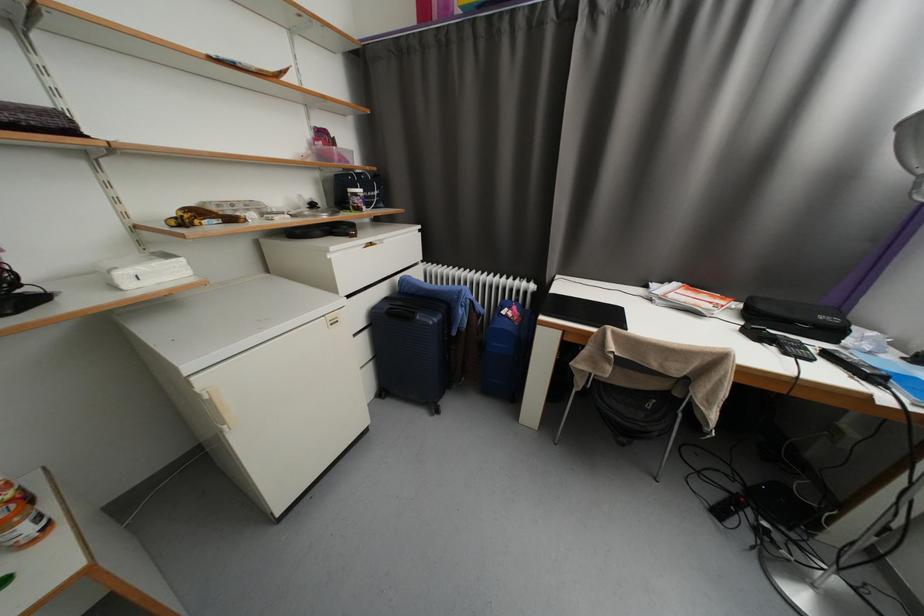
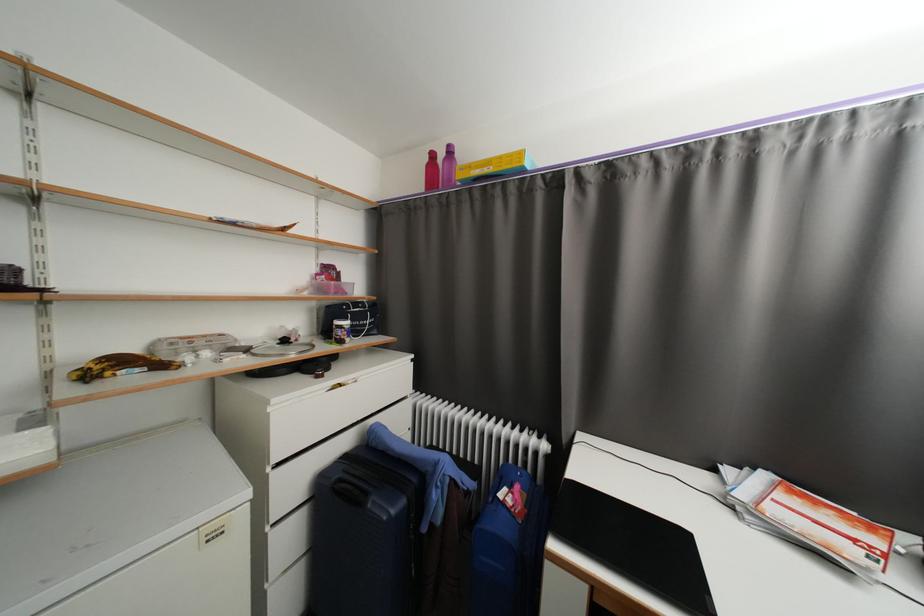
What movement of the cameraman would produce the second image?

The cameraman moved toward right, forward.